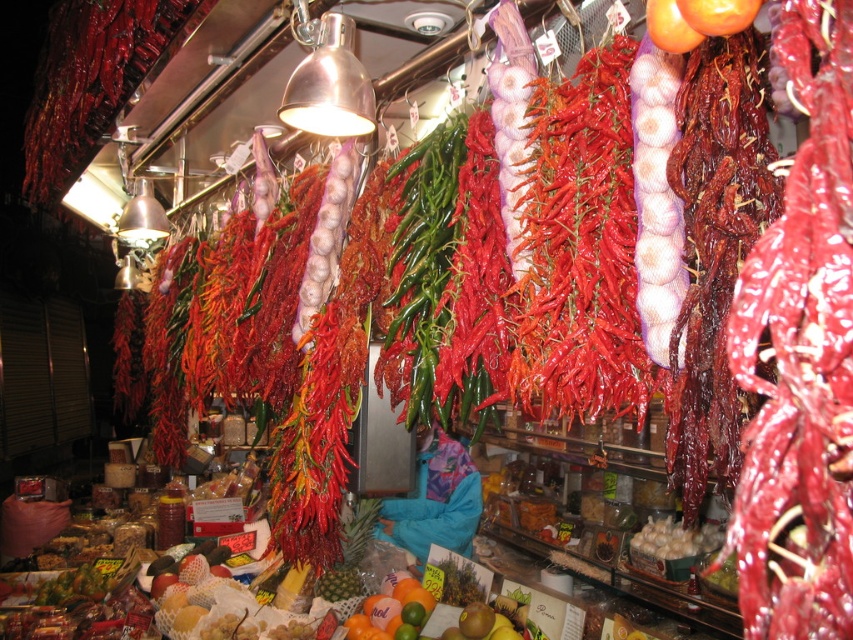
Does white/glossy onion at center appear over smooth orange citrus at lower center?

Indeed, white/glossy onion at center is positioned over smooth orange citrus at lower center.

Looking at this image, measure the distance between white/glossy onion at center and camera.

The distance of white/glossy onion at center from camera is 3.35 feet.

Does point (670, 198) come closer to viewer compared to point (404, 628)?

Yes.

Where is `white/glossy onion at center`? The width and height of the screenshot is (853, 640). white/glossy onion at center is located at coordinates (656, 196).